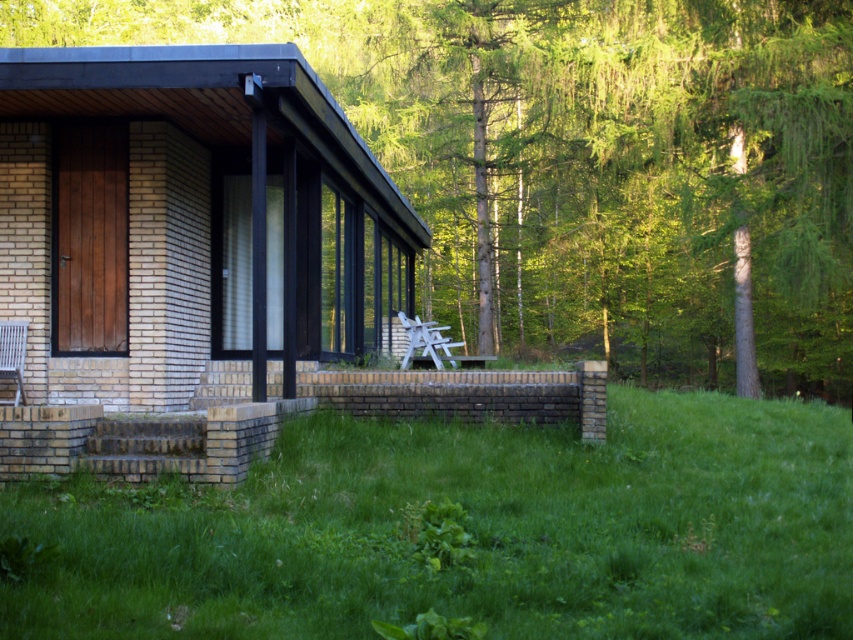
Does green grass at lower center appear over brick cabin at center?

No.

Who is more forward, (842, 454) or (329, 173)?

Point (842, 454) is more forward.

In order to click on green grass at lower center in this screenshot , I will do `click(466, 531)`.

Which is behind, point (685, 461) or point (463, 340)?

The point (463, 340) is more distant.

Does green grass at lower center have a smaller size compared to white plastic chair at center?

Actually, green grass at lower center might be larger than white plastic chair at center.

Which is behind, point (360, 621) or point (421, 355)?

The point (421, 355) is more distant.

You are a GUI agent. You are given a task and a screenshot of the screen. Output one action in this format:
    pyautogui.click(x=<x>, y=<y>)
    Task: Click on the green grass at lower center
    
    Given the screenshot: What is the action you would take?
    pyautogui.click(x=466, y=531)

Looking at this image, is green grass at lower center positioned at the back of brick wall at lower left?

No.

Measure the distance between point (288, 452) and camera.

34.37 feet

Where is `green grass at lower center`? The width and height of the screenshot is (853, 640). green grass at lower center is located at coordinates (466, 531).

At what (x,y) coordinates should I click in order to perform the action: click on green grass at lower center. Please return your answer as a coordinate pair (x, y). The height and width of the screenshot is (640, 853). Looking at the image, I should click on pyautogui.click(x=466, y=531).